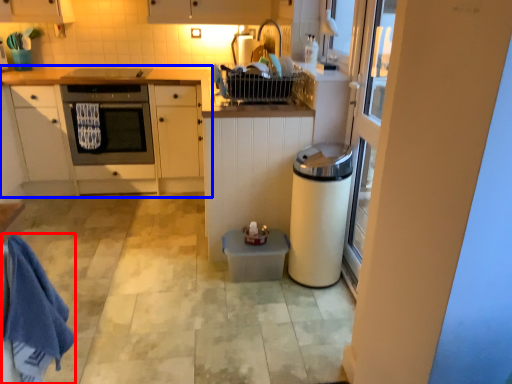
Question: Which object is closer to the camera taking this photo, bath towel (highlighted by a red box) or cabinetry (highlighted by a blue box)?

Choices:
 (A) bath towel
 (B) cabinetry

Answer: (A)